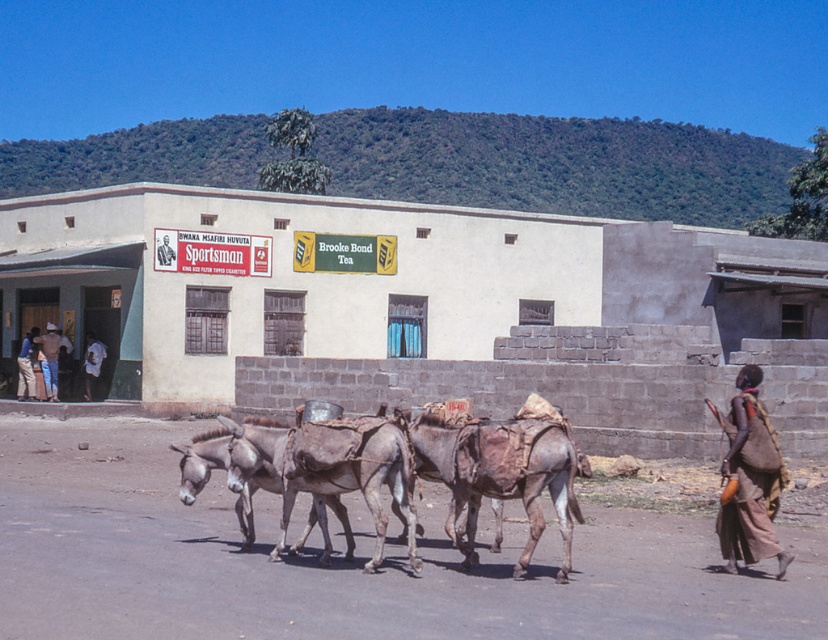
Can you confirm if brown woven cloth at lower right is smaller than gray textured donkey at center?

Incorrect, brown woven cloth at lower right is not smaller in size than gray textured donkey at center.

Which is behind, point (749, 420) or point (186, 488)?

Point (186, 488)

Locate an element on the screen. brown woven cloth at lower right is located at coordinates (749, 477).

Is gray rough skin donkey at center bigger than light brown leather jacket at left?

Correct, gray rough skin donkey at center is larger in size than light brown leather jacket at left.

Between point (345, 467) and point (26, 378), which one is positioned behind?

Positioned behind is point (26, 378).

Between point (354, 486) and point (18, 394), which one is positioned in front?

Point (354, 486) is more forward.

Find the location of a particular element. gray rough skin donkey at center is located at coordinates (417, 465).

Which is above, brown leather mule at center or brown woven cloth at lower right?

brown woven cloth at lower right

Between point (465, 445) and point (759, 449), which one is positioned in front?

Point (465, 445) is in front.

This screenshot has width=828, height=640. I want to click on brown leather mule at center, so click(x=498, y=477).